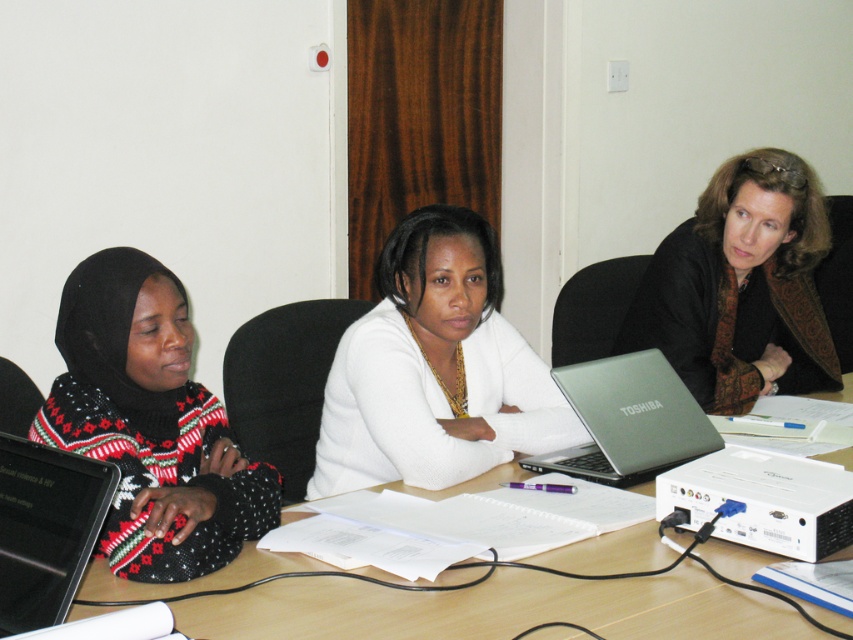
Based on the photo, who is shorter, black knitted sweater at left or matte black jacket at center?

black knitted sweater at left is shorter.

Can you confirm if black knitted sweater at left is shorter than matte black jacket at center?

Indeed, black knitted sweater at left has a lesser height compared to matte black jacket at center.

What do you see at coordinates (149, 426) in the screenshot? I see `black knitted sweater at left` at bounding box center [149, 426].

You are a GUI agent. You are given a task and a screenshot of the screen. Output one action in this format:
    pyautogui.click(x=<x>, y=<y>)
    Task: Click on the black knitted sweater at left
    The image size is (853, 640).
    Given the screenshot: What is the action you would take?
    pyautogui.click(x=149, y=426)

Is matte black jacket at center wider than black glossy laptop at left?

Correct, the width of matte black jacket at center exceeds that of black glossy laptop at left.

Can you confirm if matte black jacket at center is shorter than black glossy laptop at left?

In fact, matte black jacket at center may be taller than black glossy laptop at left.

Between point (647, 330) and point (25, 627), which one is positioned behind?

Positioned behind is point (647, 330).

Identify the location of matte black jacket at center. The height and width of the screenshot is (640, 853). (741, 288).

Between white matte sweater at center and black knitted sweater at left, which one is positioned higher?

Positioned higher is white matte sweater at center.

Is point (345, 349) more distant than point (78, 401)?

Yes, point (345, 349) is behind point (78, 401).

Which is behind, point (451, 257) or point (129, 394)?

Positioned behind is point (451, 257).

Find the location of a particular element. white matte sweater at center is located at coordinates (434, 369).